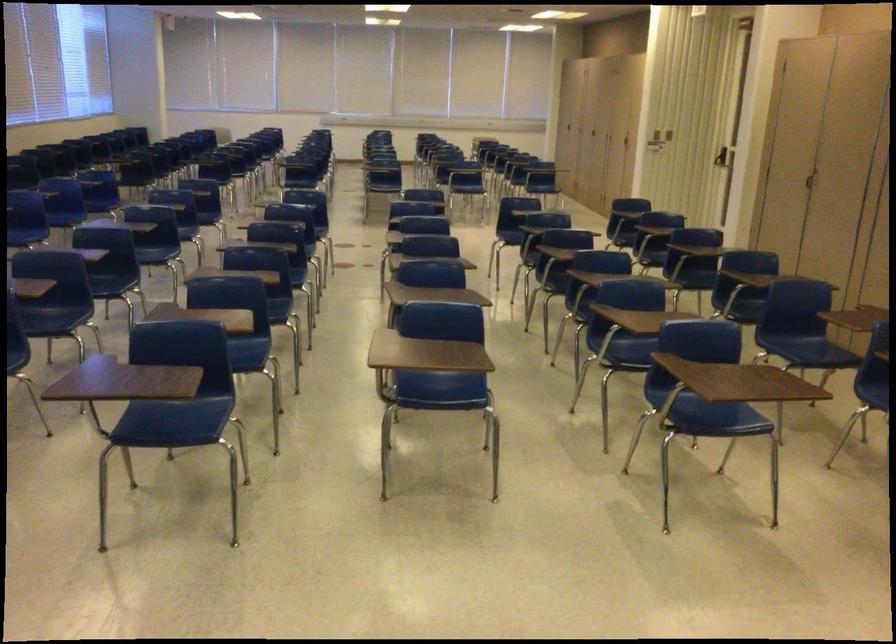
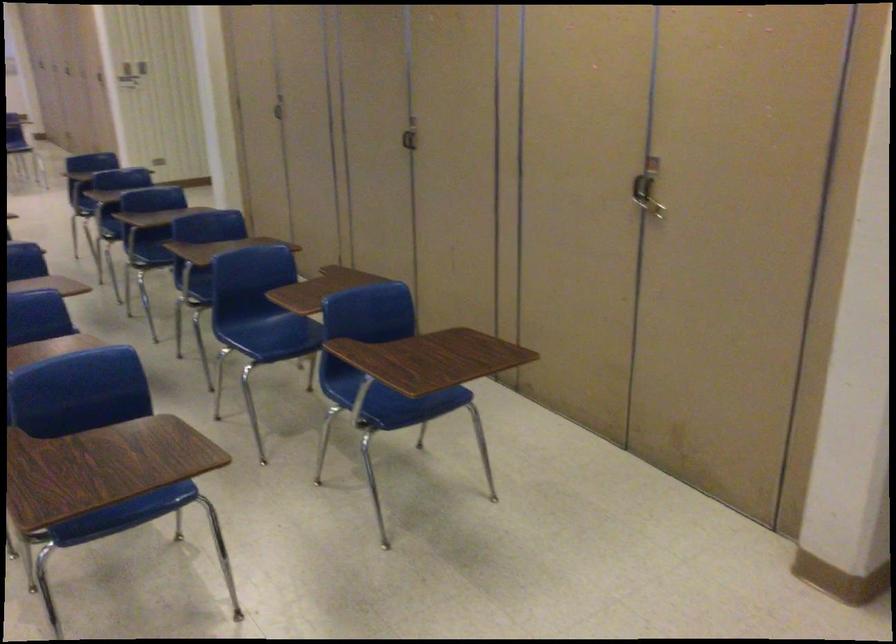
Locate, in the second image, the point that corresponds to [798,343] in the first image.

(272, 328)